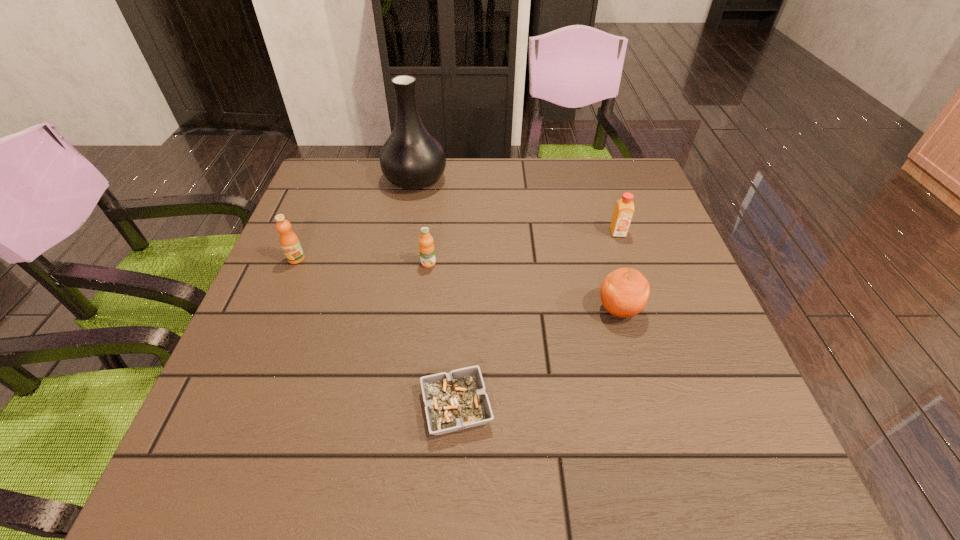
In order to click on vacant region located 0.150m on the front label of the leftmost object in this screenshot , I will do `click(273, 314)`.

This screenshot has width=960, height=540. In order to click on free space located 0.180m on the front and back of the second farthest object in this screenshot , I will do `click(637, 292)`.

What are the coordinates of `free space located on the left of the second nearest object` in the screenshot? It's located at (478, 309).

The height and width of the screenshot is (540, 960). Identify the location of vacant point located on the label of the second orange juice from left to right. (410, 424).

At what (x,y) coordinates should I click in order to perform the action: click on vacant space situated 0.360m on the right of the ashtray. Please return your answer as a coordinate pair (x, y). This screenshot has width=960, height=540. Looking at the image, I should click on coord(696,407).

Identify the location of object present at the far edge. (412, 158).

At what (x,y) coordinates should I click in order to perform the action: click on object situated at the near edge. Please return your answer as a coordinate pair (x, y). Looking at the image, I should click on (457, 400).

This screenshot has height=540, width=960. What are the coordinates of `object that is at the left edge` in the screenshot? It's located at 289,241.

Find the location of a particular element. This screenshot has height=540, width=960. orange juice located in the right edge section of the desktop is located at coordinates (624, 208).

Locate an element on the screen. This screenshot has height=540, width=960. orange positioned at the right edge is located at coordinates (624, 293).